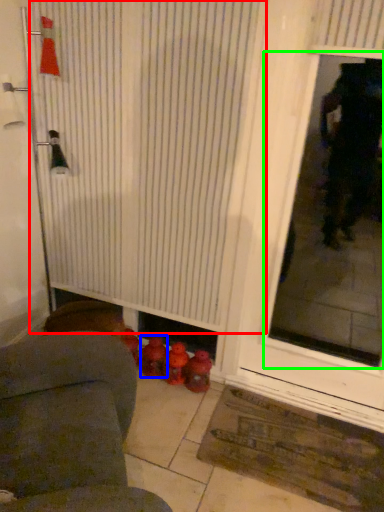
Question: Which object is the closest to the shower curtain (highlighted by a red box)? Choose among these: toy (highlighted by a blue box) or window screen (highlighted by a green box).

Choices:
 (A) toy
 (B) window screen

Answer: (A)